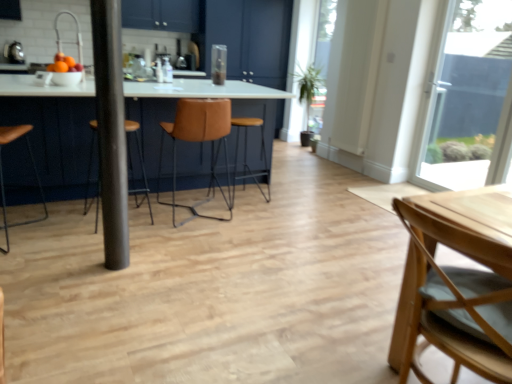
You are a GUI agent. You are given a task and a screenshot of the screen. Output one action in this format:
    pyautogui.click(x=<x>, y=<y>)
    Task: Click on the free space between transparent glass window at upper right and metallic pole at center
    
    Given the screenshot: What is the action you would take?
    pyautogui.click(x=297, y=218)